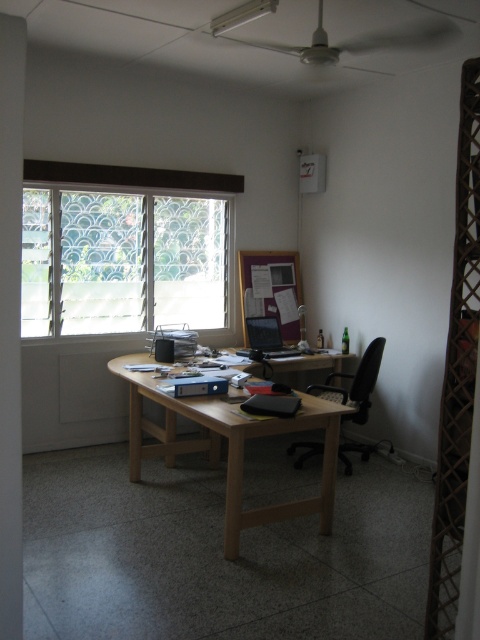
Question: Can you confirm if black mesh office chair at center is positioned to the left of satin black laptop at center?

Choices:
 (A) no
 (B) yes

Answer: (A)

Question: Which object is the farthest from the black mesh office chair at center?

Choices:
 (A) satin black laptop at center
 (B) clear glass window at upper left
 (C) light wood/wooden computer desk at center

Answer: (B)

Question: Can you confirm if light wood/wooden computer desk at center is wider than black mesh office chair at center?

Choices:
 (A) yes
 (B) no

Answer: (A)

Question: Observing the image, what is the correct spatial positioning of black mesh office chair at center in reference to satin black laptop at center?

Choices:
 (A) right
 (B) left

Answer: (A)

Question: Which object appears closest to the camera in this image?

Choices:
 (A) clear glass window at upper left
 (B) black mesh office chair at center

Answer: (B)

Question: Among these points, which one is farthest from the camera?

Choices:
 (A) (47, 314)
 (B) (166, 454)
 (C) (266, 328)

Answer: (C)